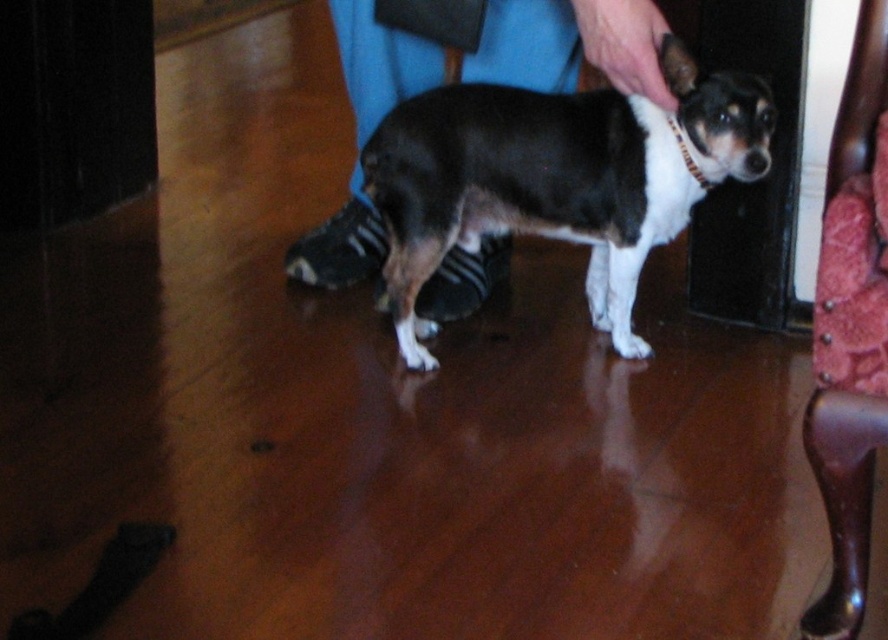
Where is the black smooth dog at center located in the image?

The black smooth dog at center is located at point (557, 179) in the image.

You are a photographer setting up a shoot in this room. You need to position the black smooth dog at center and the velvet red armchair at right so that they are aligned with your camera frame. Based on their current positions, which object is closer to the left edge of the frame?

The black smooth dog at center is closer to the left edge of the frame because it is positioned to the left of the velvet red armchair at right.